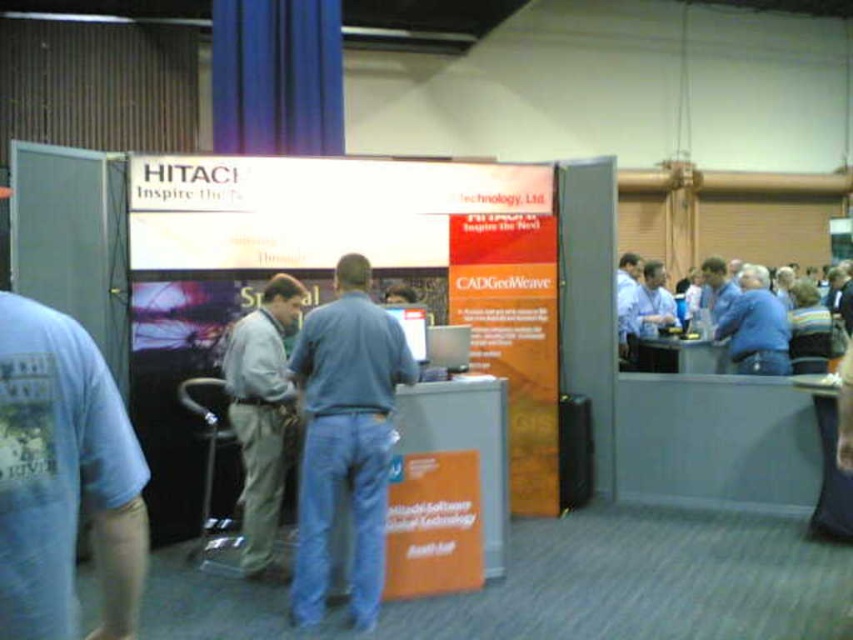
You are a photographer at the Hitachi booth and need to position a camera between the blue jeans at center and the light gray fabric pants at center. The camera requires at least 30 cm of space between the two objects to capture both in frame. Can the camera fit between them?

The blue jeans at center might be wider than light gray fabric pants at center, but without exact measurements, it is uncertain if the 30 cm space is available. The photographer should measure the distance between them first.

Consider the image. You are a photographer at the exhibition. You need to capture a photo of the two people at the Hitachi booth. The blue jeans at center and the light gray fabric pants at center are part of their outfits. Since you want to ensure both are clearly visible, which person should you focus on first to account for their clothing sizes?

The blue jeans at center has a smaller size compared to the light gray fabric pants at center. Therefore, you should focus on the person wearing the light gray fabric pants at center first because their clothing is larger and might require more attention to detail to capture clearly.